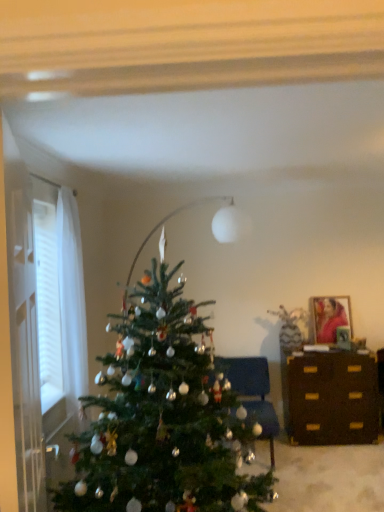
Question: Considering the positions of white sheer curtain at left and dark brown wooden dresser at right in the image, is white sheer curtain at left bigger or smaller than dark brown wooden dresser at right?

Choices:
 (A) small
 (B) big

Answer: (A)

Question: Is point (14, 247) positioned closer to the camera than point (362, 387)?

Choices:
 (A) closer
 (B) farther

Answer: (A)

Question: Considering the real-world distances, which object is farthest from the dark brown wooden dresser at right?

Choices:
 (A) green matte christmas tree at center
 (B) velvet blue chair at center
 (C) matte wooden picture frame at upper right
 (D) white sheer curtain at left

Answer: (D)

Question: Which object is the closest to the dark brown wooden dresser at right?

Choices:
 (A) green matte christmas tree at center
 (B) white sheer curtain at left
 (C) velvet blue chair at center
 (D) matte wooden picture frame at upper right

Answer: (C)